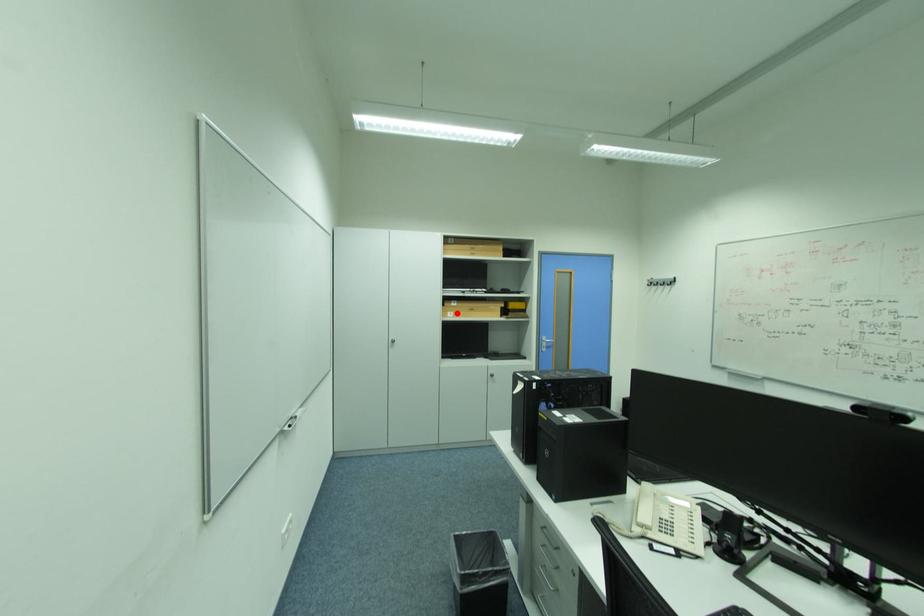
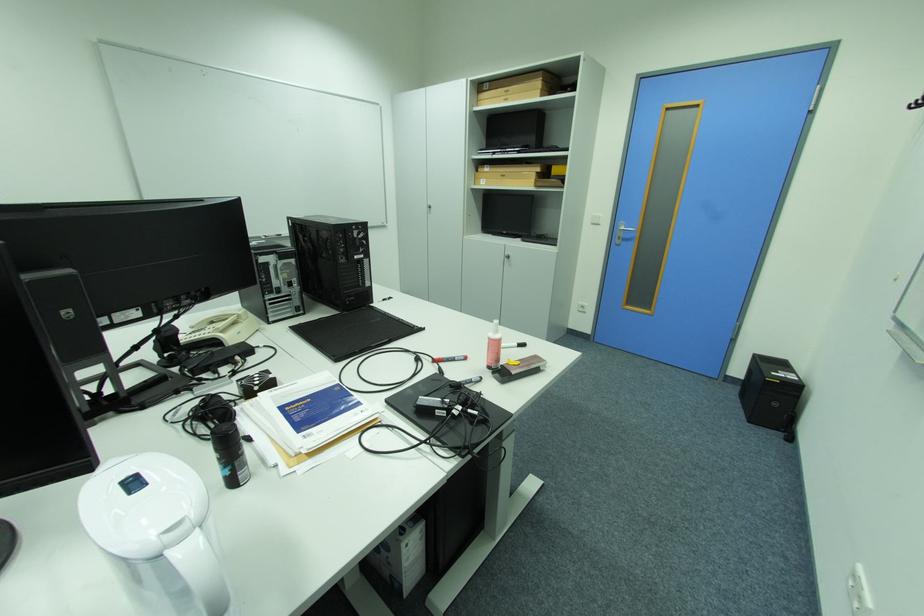
Question: I am providing you with two images of the same scene from different viewpoints. A red point is shown in image1. For the corresponding object point in image2, is it positioned nearer or farther from the camera?

Choices:
 (A) Nearer
 (B) Farther

Answer: (A)